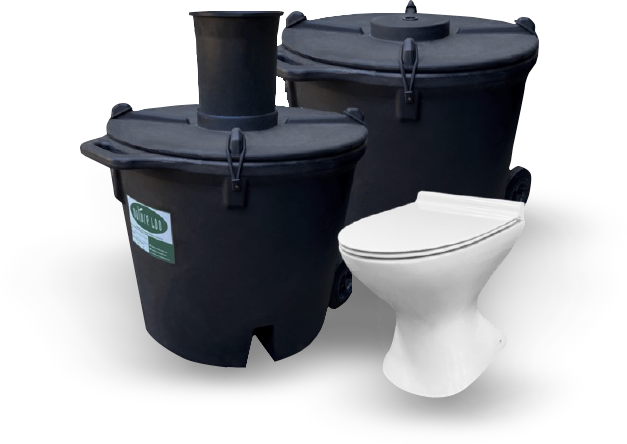
Where is `toilet lid`? The image size is (627, 444). toilet lid is located at coordinates (414, 227).